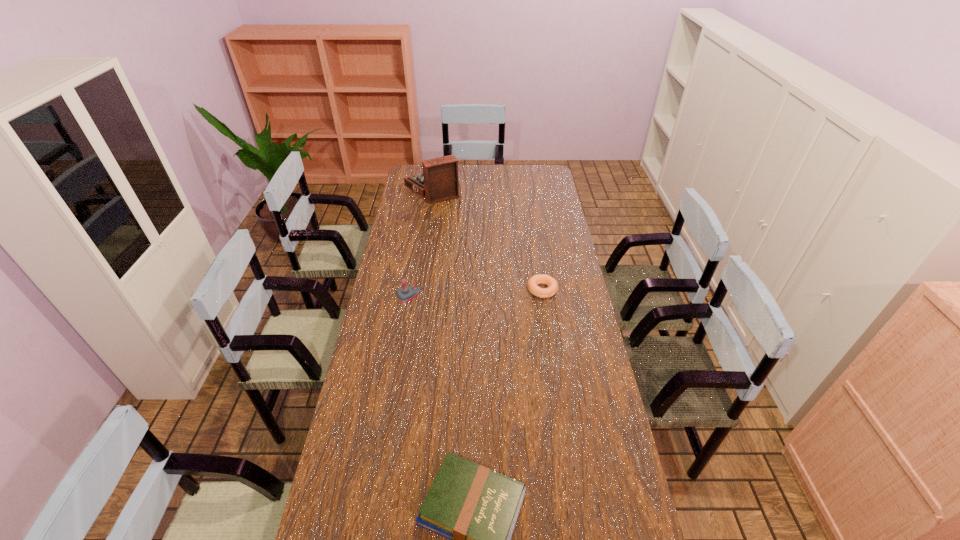
Locate which object ranks third in proximity to the joystick. Please provide its 2D coordinates. Your answer should be formatted as a tuple, i.e. [(x, y)], where the tuple contains the x and y coordinates of a point satisfying the conditions above.

[(476, 508)]

Locate an element on the screen. Image resolution: width=960 pixels, height=540 pixels. the second closest object to the tallest object is located at coordinates (535, 280).

You are a GUI agent. You are given a task and a screenshot of the screen. Output one action in this format:
    pyautogui.click(x=<x>, y=<y>)
    Task: Click on the vacant position in the image that satisfies the following two spatial constraints: 1. on the front side of the bagel; 2. on the right side of the farthest object
    The height and width of the screenshot is (540, 960).
    Given the screenshot: What is the action you would take?
    pyautogui.click(x=417, y=290)

Identify the location of free location that satisfies the following two spatial constraints: 1. on the front side of the joystick; 2. on the left side of the farthest object. (417, 292).